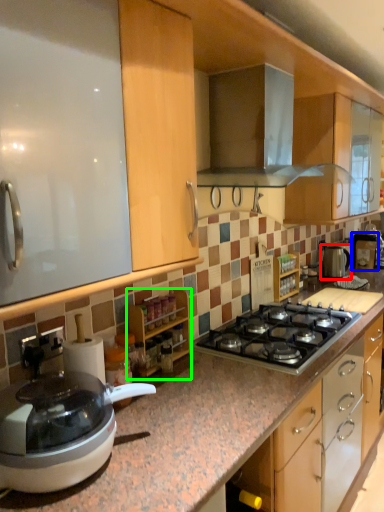
Question: Based on their relative distances, which object is farther from kitchen appliance (highlighted by a red box)? Choose from coffee machine (highlighted by a blue box) and cabinetry (highlighted by a green box).

Choices:
 (A) coffee machine
 (B) cabinetry

Answer: (B)